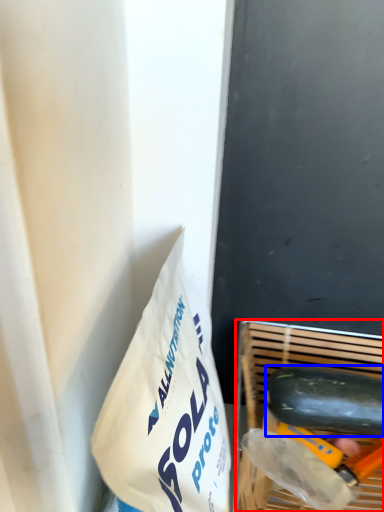
Question: Which object appears closest to the camera in this image, basket (highlighted by a red box) or cucumber (highlighted by a blue box)?

Choices:
 (A) basket
 (B) cucumber

Answer: (A)